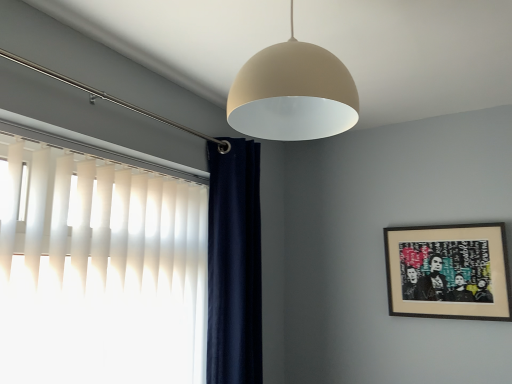
The height and width of the screenshot is (384, 512). What do you see at coordinates (103, 272) in the screenshot?
I see `white vertical blinds at left` at bounding box center [103, 272].

Locate an element on the screen. Image resolution: width=512 pixels, height=384 pixels. matte beige dome at upper center is located at coordinates (293, 93).

Considering their positions, is navy velvet curtain at left located in front of or behind matte beige dome at upper center?

In the image, navy velvet curtain at left appears behind matte beige dome at upper center.

Can you confirm if navy velvet curtain at left is thinner than matte beige dome at upper center?

Correct, the width of navy velvet curtain at left is less than that of matte beige dome at upper center.

Is navy velvet curtain at left at the right side of matte beige dome at upper center?

Incorrect, navy velvet curtain at left is not on the right side of matte beige dome at upper center.

Would you say matte beige dome at upper center is outside navy velvet curtain at left?

Yes, matte beige dome at upper center is outside of navy velvet curtain at left.

How many degrees apart are the facing directions of matte beige dome at upper center and navy velvet curtain at left?

0.17 degrees.

From the image's perspective, is matte beige dome at upper center above or below navy velvet curtain at left?

Based on their image positions, matte beige dome at upper center is located above navy velvet curtain at left.

Looking at this image, which object is thinner, matte beige dome at upper center or navy velvet curtain at left?

navy velvet curtain at left is thinner.

Does wooden framed artwork at right touch white vertical blinds at left?

No, wooden framed artwork at right is not beside white vertical blinds at left.

From a real-world perspective, is wooden framed artwork at right below white vertical blinds at left?

No, from a real-world perspective, wooden framed artwork at right is not beneath white vertical blinds at left.

From the image's perspective, who appears lower, wooden framed artwork at right or white vertical blinds at left?

From the image's view, wooden framed artwork at right is below.

Is white vertical blinds at left positioned with its back to matte beige dome at upper center?

No, white vertical blinds at left is not facing away from matte beige dome at upper center.

Is white vertical blinds at left with matte beige dome at upper center?

They are not placed beside each other.

From the image's perspective, who appears lower, white vertical blinds at left or matte beige dome at upper center?

white vertical blinds at left appears lower in the image.

How different are the orientations of white vertical blinds at left and matte beige dome at upper center in degrees?

The angle between the facing direction of white vertical blinds at left and the facing direction of matte beige dome at upper center is 1.04 degrees.

Can you tell me how much wooden framed artwork at right and matte beige dome at upper center differ in facing direction?

The facing directions of wooden framed artwork at right and matte beige dome at upper center are 90.7 degrees apart.

Which is in front, wooden framed artwork at right or matte beige dome at upper center?

matte beige dome at upper center is closer to the camera.

From a real-world perspective, is wooden framed artwork at right positioned above or below matte beige dome at upper center?

wooden framed artwork at right is situated lower than matte beige dome at upper center in the real world.

Is wooden framed artwork at right placed right next to matte beige dome at upper center?

No, wooden framed artwork at right is not in contact with matte beige dome at upper center.

Is point (236, 115) more distant than point (29, 151)?

No, it is not.

Are matte beige dome at upper center and white vertical blinds at left beside each other?

No.

In terms of height, does matte beige dome at upper center look taller or shorter compared to white vertical blinds at left?

Clearly, matte beige dome at upper center is shorter compared to white vertical blinds at left.

Is matte beige dome at upper center behind white vertical blinds at left?

No, matte beige dome at upper center is closer to the viewer.

Is navy velvet curtain at left shorter than white vertical blinds at left?

No, navy velvet curtain at left is not shorter than white vertical blinds at left.

From a real-world perspective, is navy velvet curtain at left positioned under white vertical blinds at left based on gravity?

No, from a real-world perspective, navy velvet curtain at left is not beneath white vertical blinds at left.

Would you say navy velvet curtain at left contains white vertical blinds at left?

Actually, white vertical blinds at left is outside navy velvet curtain at left.

You are a GUI agent. You are given a task and a screenshot of the screen. Output one action in this format:
    pyautogui.click(x=<x>, y=<y>)
    Task: Click on the curtain below the matte beige dome at upper center (from a real-world perspective)
    This screenshot has height=384, width=512.
    Given the screenshot: What is the action you would take?
    pyautogui.click(x=234, y=264)

Image resolution: width=512 pixels, height=384 pixels. I want to click on curtain that appears on the left of matte beige dome at upper center, so pos(234,264).

Estimate the real-world distances between objects in this image. Which object is closer to wooden framed artwork at right, white vertical blinds at left or matte beige dome at upper center?

matte beige dome at upper center lies closer to wooden framed artwork at right than the other object.

Considering their positions, is wooden framed artwork at right positioned closer to matte beige dome at upper center than navy velvet curtain at left?

The object closer to matte beige dome at upper center is navy velvet curtain at left.

Looking at the image, which one is located further to white vertical blinds at left, wooden framed artwork at right or matte beige dome at upper center?

wooden framed artwork at right lies further to white vertical blinds at left than the other object.

Estimate the real-world distances between objects in this image. Which object is closer to white vertical blinds at left, wooden framed artwork at right or navy velvet curtain at left?

Based on the image, navy velvet curtain at left appears to be nearer to white vertical blinds at left.

Which object lies nearer to the anchor point navy velvet curtain at left, white vertical blinds at left or wooden framed artwork at right?

The object closer to navy velvet curtain at left is white vertical blinds at left.

Considering their positions, is matte beige dome at upper center positioned further to navy velvet curtain at left than wooden framed artwork at right?

Among the two, wooden framed artwork at right is located further to navy velvet curtain at left.

Looking at the image, which one is located further to matte beige dome at upper center, navy velvet curtain at left or white vertical blinds at left?

Among the two, navy velvet curtain at left is located further to matte beige dome at upper center.

Estimate the real-world distances between objects in this image. Which object is closer to white vertical blinds at left, matte beige dome at upper center or navy velvet curtain at left?

navy velvet curtain at left is closer to white vertical blinds at left.

What are the coordinates of `curtain between white vertical blinds at left and wooden framed artwork at right` in the screenshot? It's located at (234, 264).

The width and height of the screenshot is (512, 384). I want to click on window located between matte beige dome at upper center and navy velvet curtain at left in the depth direction, so click(x=103, y=272).

At what (x,y) coordinates should I click in order to perform the action: click on lamp located between white vertical blinds at left and wooden framed artwork at right in the left-right direction. Please return your answer as a coordinate pair (x, y). Looking at the image, I should click on tap(293, 93).

Find the location of a particular element. curtain between matte beige dome at upper center and wooden framed artwork at right in the front-back direction is located at coordinates (234, 264).